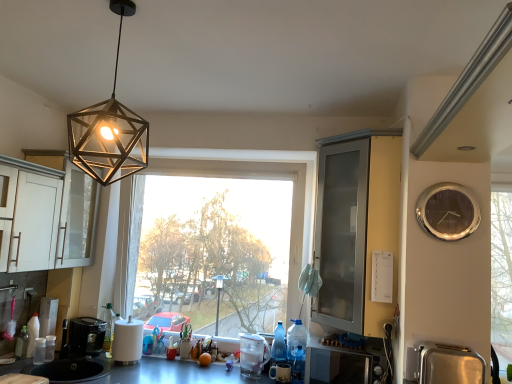
Question: Is silver metallic clock at right smaller than metallic hexagonal light fixture at upper center?

Choices:
 (A) yes
 (B) no

Answer: (A)

Question: Can you confirm if silver metallic clock at right is positioned to the right of metallic hexagonal light fixture at upper center?

Choices:
 (A) no
 (B) yes

Answer: (B)

Question: Can you confirm if silver metallic clock at right is wider than metallic hexagonal light fixture at upper center?

Choices:
 (A) no
 (B) yes

Answer: (A)

Question: From a real-world perspective, does silver metallic clock at right stand above metallic hexagonal light fixture at upper center?

Choices:
 (A) yes
 (B) no

Answer: (B)

Question: Is silver metallic clock at right aimed at metallic hexagonal light fixture at upper center?

Choices:
 (A) yes
 (B) no

Answer: (B)

Question: In the image, is clear plastic blender at center, placed as the third appliance when sorted from front to back, positioned in front of or behind translucent blue bottle at lower center, the 1th bottle viewed from the right?

Choices:
 (A) behind
 (B) front

Answer: (A)

Question: Considering the positions of clear plastic blender at center, which is counted as the 3th appliance, starting from the right, and translucent blue bottle at lower center, the 1th bottle viewed from the right, in the image, is clear plastic blender at center, which is counted as the 3th appliance, starting from the right, taller or shorter than translucent blue bottle at lower center, the 1th bottle viewed from the right,?

Choices:
 (A) short
 (B) tall

Answer: (B)

Question: Does point (243, 337) appear closer or farther from the camera than point (295, 349)?

Choices:
 (A) closer
 (B) farther

Answer: (B)

Question: Considering the relative positions of clear plastic blender at center, which is the 2th appliance from back to front, and translucent blue bottle at lower center, acting as the second bottle starting from the back, in the image provided, is clear plastic blender at center, which is the 2th appliance from back to front, to the left or to the right of translucent blue bottle at lower center, acting as the second bottle starting from the back,?

Choices:
 (A) left
 (B) right

Answer: (A)

Question: In terms of width, does clear glass cabinet at right look wider or thinner when compared to metallic gray countertop at lower center?

Choices:
 (A) thin
 (B) wide

Answer: (A)

Question: From the image's perspective, is clear glass cabinet at right located above or below metallic gray countertop at lower center?

Choices:
 (A) above
 (B) below

Answer: (A)

Question: Is point (342, 226) closer or farther from the camera than point (212, 365)?

Choices:
 (A) farther
 (B) closer

Answer: (B)

Question: Looking at the image, does clear glass cabinet at right seem bigger or smaller compared to metallic gray countertop at lower center?

Choices:
 (A) small
 (B) big

Answer: (A)

Question: From a real-world perspective, is metallic hexagonal light fixture at upper center positioned above or below metallic gray countertop at lower center?

Choices:
 (A) below
 (B) above

Answer: (B)

Question: In the image, is metallic hexagonal light fixture at upper center positioned in front of or behind metallic gray countertop at lower center?

Choices:
 (A) behind
 (B) front

Answer: (B)